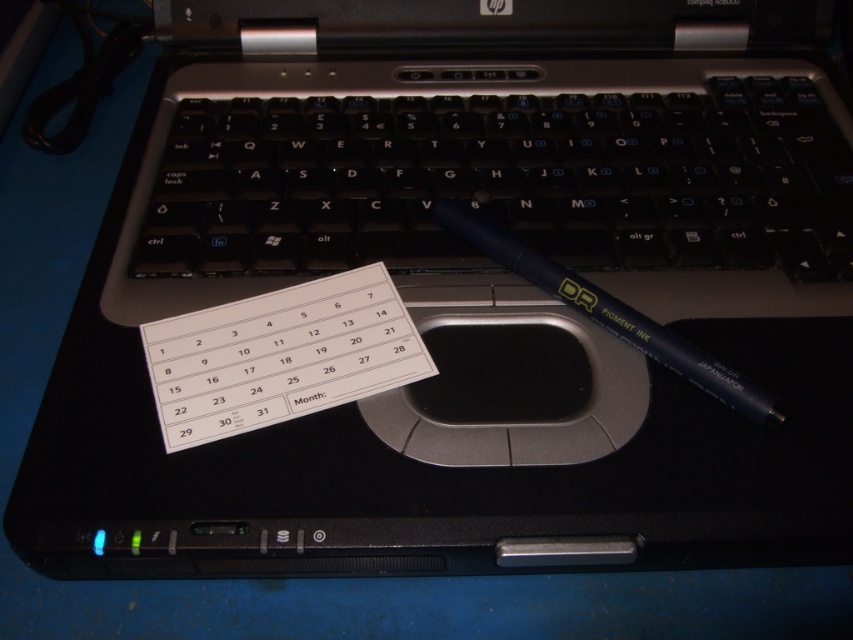
In the scene shown: Is white paper calendar at center positioned at the back of matte black pen at center?

Yes, white paper calendar at center is behind matte black pen at center.

Measure the distance between white paper calendar at center and matte black pen at center.

white paper calendar at center is 5.53 inches from matte black pen at center.

The image size is (853, 640). Identify the location of white paper calendar at center. (280, 355).

Locate an element on the screen. white paper calendar at center is located at coordinates (280, 355).

Between black plastic keyboard at center and white paper calendar at center, which one appears on the right side from the viewer's perspective?

black plastic keyboard at center

Consider the image. Which of these two, black plastic keyboard at center or white paper calendar at center, stands taller?

black plastic keyboard at center is taller.

Who is more distant from viewer, (397, 256) or (349, 384)?

The point (397, 256) is more distant.

Locate an element on the screen. The image size is (853, 640). black plastic keyboard at center is located at coordinates (505, 180).

Measure the distance between black plastic keyboard at center and matte black pen at center.

They are 5.56 inches apart.

Is black plastic keyboard at center taller than matte black pen at center?

Correct, black plastic keyboard at center is much taller as matte black pen at center.

Measure the distance between black plastic keyboard at center and camera.

The distance of black plastic keyboard at center from camera is 21.62 inches.

At what (x,y) coordinates should I click in order to perform the action: click on black plastic keyboard at center. Please return your answer as a coordinate pair (x, y). The height and width of the screenshot is (640, 853). Looking at the image, I should click on (505, 180).